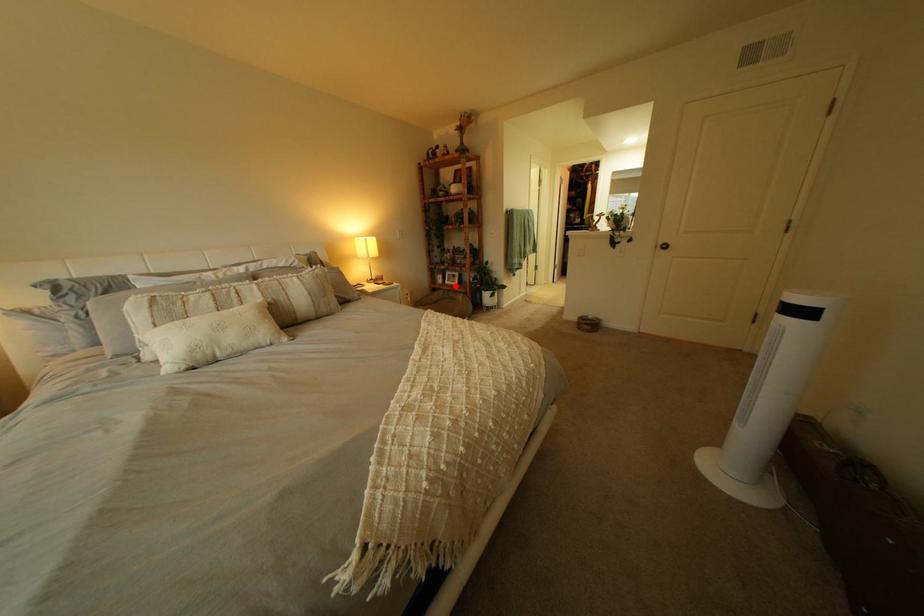
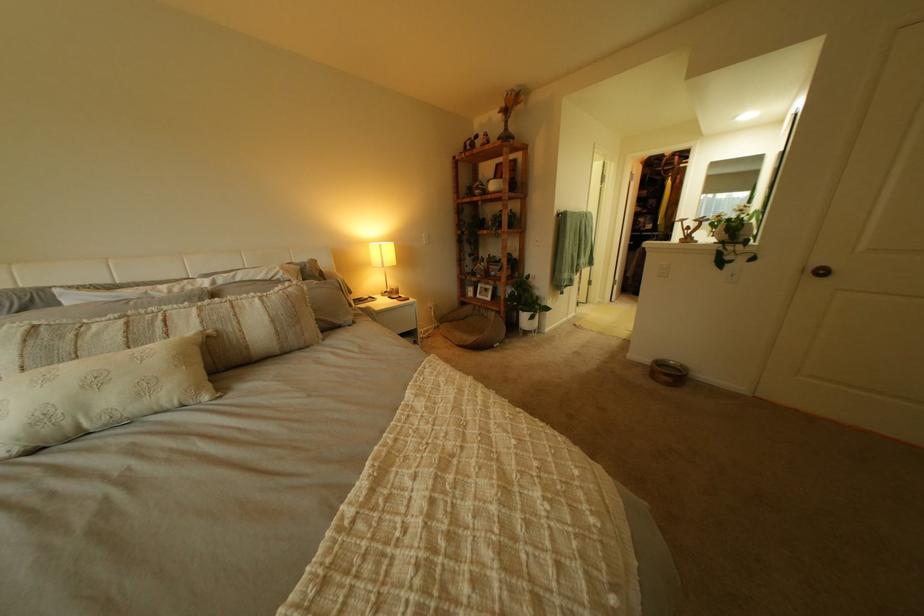
Find the pixel in the second image that matches the highlighted location in the first image.

(485, 300)